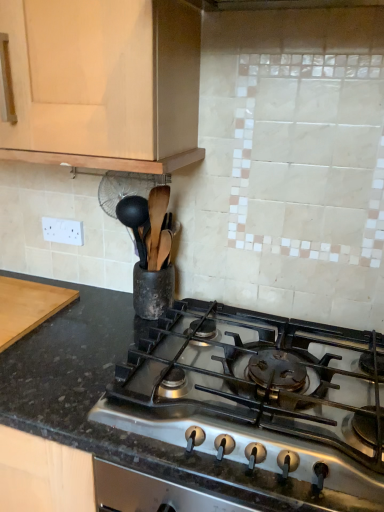
Question: Is black granite countertop at center at the left side of wooden cutting board at left?

Choices:
 (A) yes
 (B) no

Answer: (B)

Question: Can wooden cutting board at left be found inside black granite countertop at center?

Choices:
 (A) no
 (B) yes

Answer: (A)

Question: Is black granite countertop at center further to the viewer compared to wooden cutting board at left?

Choices:
 (A) yes
 (B) no

Answer: (B)

Question: From a real-world perspective, is black granite countertop at center under wooden cutting board at left?

Choices:
 (A) yes
 (B) no

Answer: (B)

Question: From the image's perspective, does black granite countertop at center appear higher than wooden cutting board at left?

Choices:
 (A) no
 (B) yes

Answer: (A)

Question: Could you tell me if black granite countertop at center is facing wooden cutting board at left?

Choices:
 (A) yes
 (B) no

Answer: (B)

Question: Can you confirm if matte wood cabinet at upper left is wider than black granite countertop at center?

Choices:
 (A) no
 (B) yes

Answer: (A)

Question: From the image's perspective, is matte wood cabinet at upper left beneath black granite countertop at center?

Choices:
 (A) no
 (B) yes

Answer: (A)

Question: Is matte wood cabinet at upper left further to the viewer compared to black granite countertop at center?

Choices:
 (A) yes
 (B) no

Answer: (A)

Question: Does matte wood cabinet at upper left contain black granite countertop at center?

Choices:
 (A) yes
 (B) no

Answer: (B)

Question: Is matte wood cabinet at upper left far from black granite countertop at center?

Choices:
 (A) no
 (B) yes

Answer: (A)

Question: Considering the relative sizes of matte wood cabinet at upper left and black granite countertop at center in the image provided, is matte wood cabinet at upper left smaller than black granite countertop at center?

Choices:
 (A) no
 (B) yes

Answer: (A)

Question: Is matte wood cabinet at upper left in front of wooden cutting board at left?

Choices:
 (A) yes
 (B) no

Answer: (A)